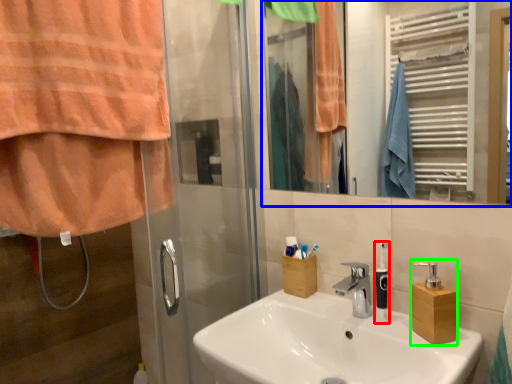
Question: Which object is the closest to the soap dispenser (highlighted by a red box)? Choose among these: mirror (highlighted by a blue box) or soap dispenser (highlighted by a green box).

Choices:
 (A) mirror
 (B) soap dispenser

Answer: (B)